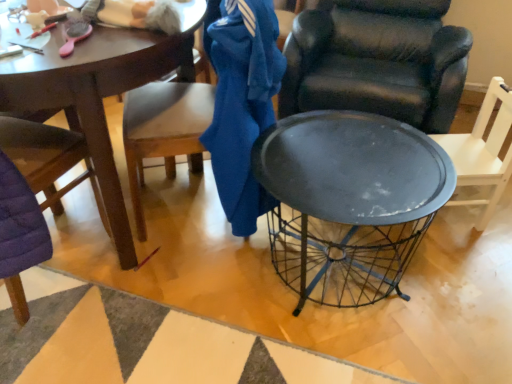
The height and width of the screenshot is (384, 512). In order to click on free point in front of wooden chair at left, arranged as the second chair when viewed from the left in this screenshot , I will do `click(199, 288)`.